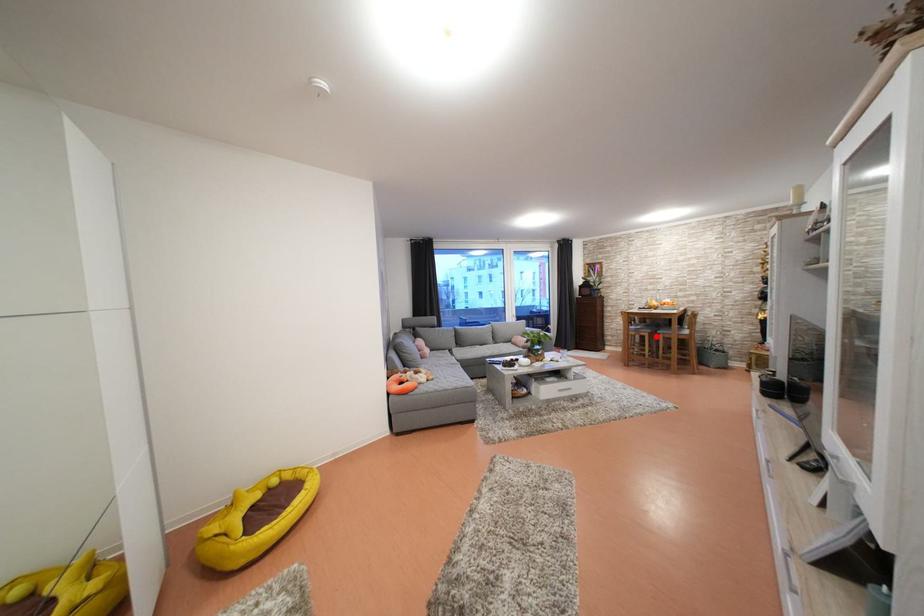
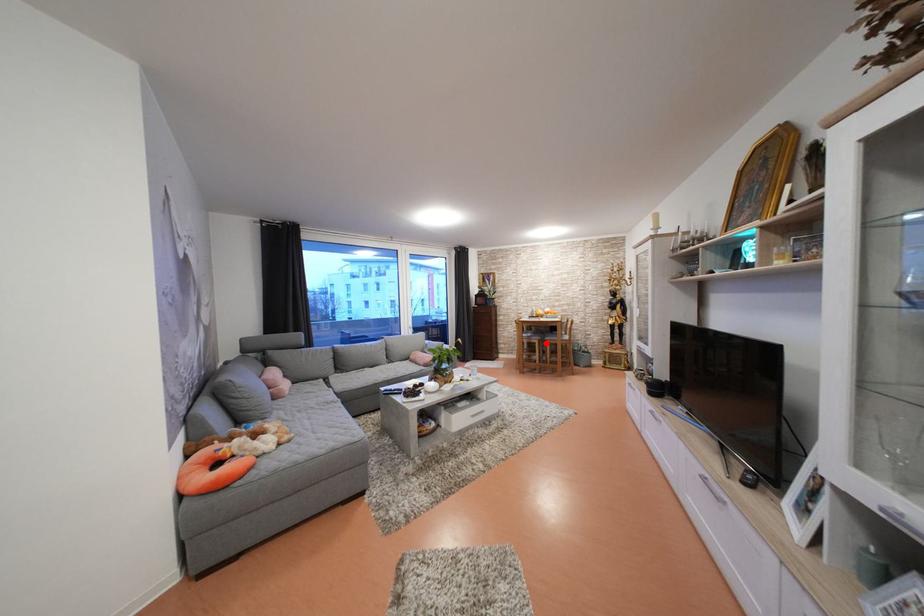
I am providing you with two images of the same scene from different viewpoints. A red point is marked on the first image and another point is marked on the second image. Do the highlighted points in image1 and image2 indicate the same real-world spot?

Yes